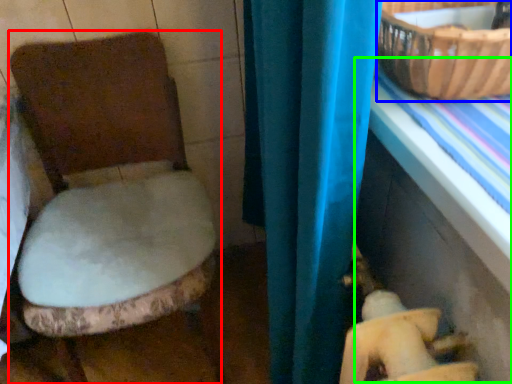
Question: Estimate the real-world distances between objects in this image. Which object is farther from toilet (highlighted by a red box), basket (highlighted by a blue box) or table (highlighted by a green box)?

Choices:
 (A) basket
 (B) table

Answer: (A)